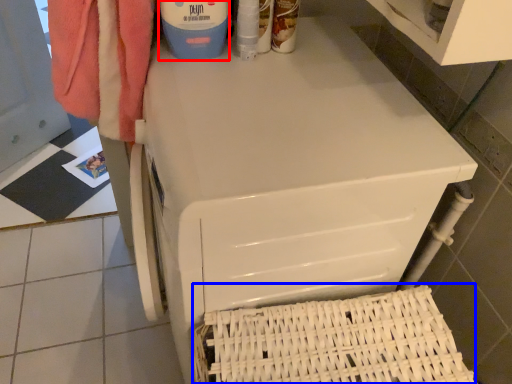
Question: Which of the following is the farthest to the observer, cleaning product (highlighted by a red box) or basket (highlighted by a blue box)?

Choices:
 (A) cleaning product
 (B) basket

Answer: (A)